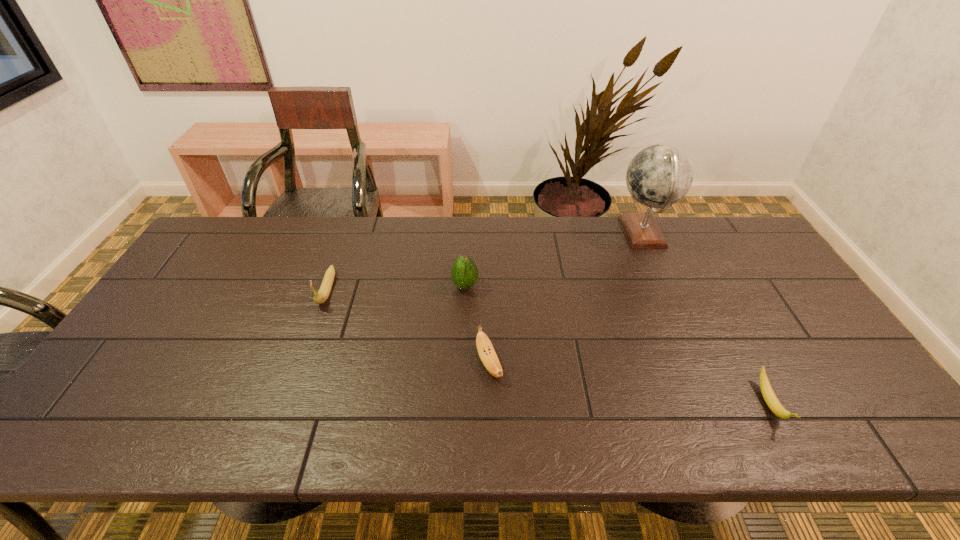
Find the location of a particular element. The height and width of the screenshot is (540, 960). object that ranks as the second closest to the rightmost banana is located at coordinates (487, 354).

You are a GUI agent. You are given a task and a screenshot of the screen. Output one action in this format:
    pyautogui.click(x=<x>, y=<y>)
    Task: Click on the object that ranks as the second closest to the rightmost object
    
    Given the screenshot: What is the action you would take?
    pyautogui.click(x=487, y=354)

You are a GUI agent. You are given a task and a screenshot of the screen. Output one action in this format:
    pyautogui.click(x=<x>, y=<y>)
    Task: Click on the second closest banana relative to the rightmost banana
    The width and height of the screenshot is (960, 540).
    Given the screenshot: What is the action you would take?
    pyautogui.click(x=325, y=288)

Select which banana is the second closest to the second banana from right to left. Please provide its 2D coordinates. Your answer should be formatted as a tuple, i.e. [(x, y)], where the tuple contains the x and y coordinates of a point satisfying the conditions above.

[(768, 394)]

Where is `vacant area that satisfies the following two spatial constraints: 1. at the equator of the fourth object from left to right; 2. at the stem of the leftmost object`? vacant area that satisfies the following two spatial constraints: 1. at the equator of the fourth object from left to right; 2. at the stem of the leftmost object is located at coordinates (667, 289).

Where is `vacant space that satisfies the following two spatial constraints: 1. at the equator of the second object from right to left; 2. at the stem of the leftmost object`? The image size is (960, 540). vacant space that satisfies the following two spatial constraints: 1. at the equator of the second object from right to left; 2. at the stem of the leftmost object is located at coordinates (667, 289).

The width and height of the screenshot is (960, 540). I want to click on free space that satisfies the following two spatial constraints: 1. at the stem of the second banana from left to right; 2. on the left side of the third tallest object, so click(300, 364).